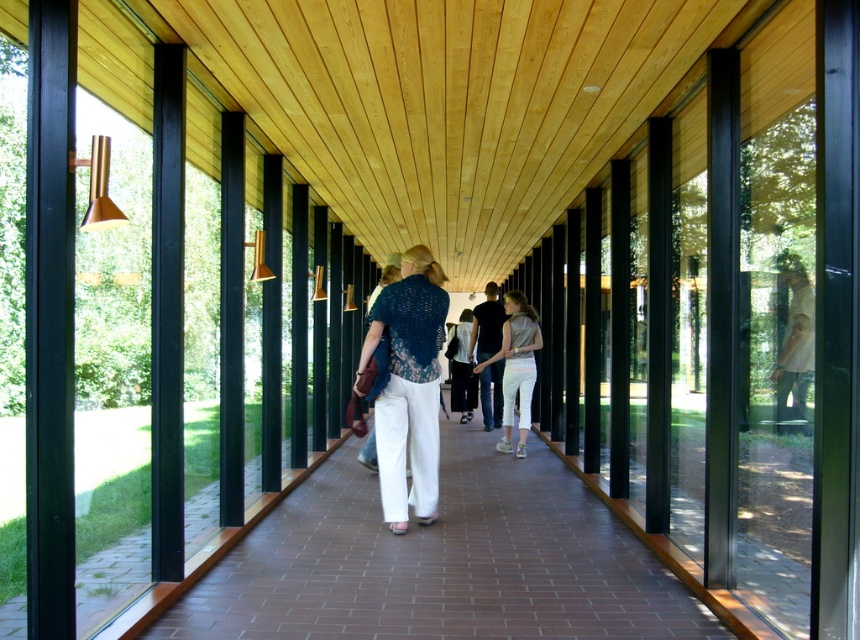
You are standing in the corridor and notice a brown brick path at center and a person wearing white cotton pants at center. From your perspective, which object is to the left?

The white cotton pants at center are to the left of the brown brick path at center because the brown brick path at center is positioned on the right side of white cotton pants at center.

You are standing at the entrance of the corridor and see the brown brick path at center and the dark blue shirt at center. Which object is shorter in height?

The brown brick path at center is shorter in height than the dark blue shirt at center because it is not as tall as the dark blue shirt at center.

You are an observer standing at the entrance of the corridor. You see a person wearing a knitted blue blouse at center and light beige cotton pants at center. Which clothing item is positioned higher on the person?

The knitted blue blouse at center is located above the light beige cotton pants at center, so it is positioned higher on the person.